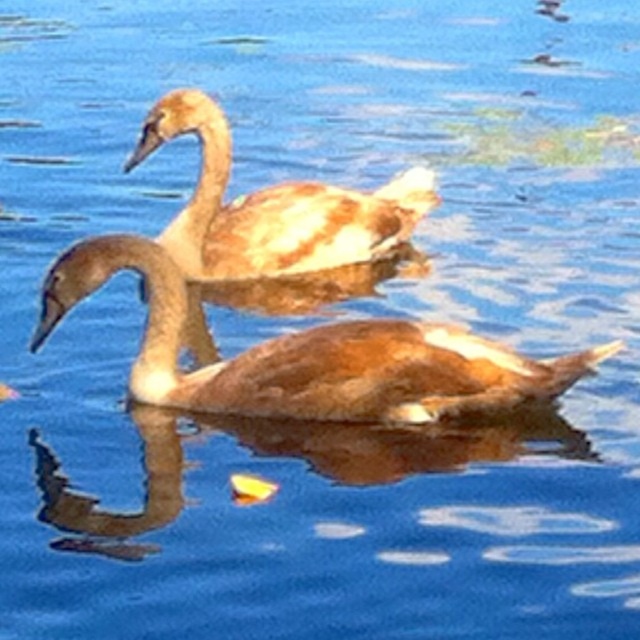
Question: Can you confirm if brown matte swan at center is thinner than brown feathered swan at upper center?

Choices:
 (A) yes
 (B) no

Answer: (B)

Question: Among these points, which one is farthest from the camera?

Choices:
 (A) (534, 396)
 (B) (308, 259)

Answer: (B)

Question: Is brown matte swan at center positioned behind brown feathered swan at upper center?

Choices:
 (A) no
 (B) yes

Answer: (A)

Question: Which of the following is the farthest from the observer?

Choices:
 (A) (200, 100)
 (B) (506, 368)

Answer: (A)

Question: Does brown matte swan at center appear on the right side of brown feathered swan at upper center?

Choices:
 (A) yes
 (B) no

Answer: (A)